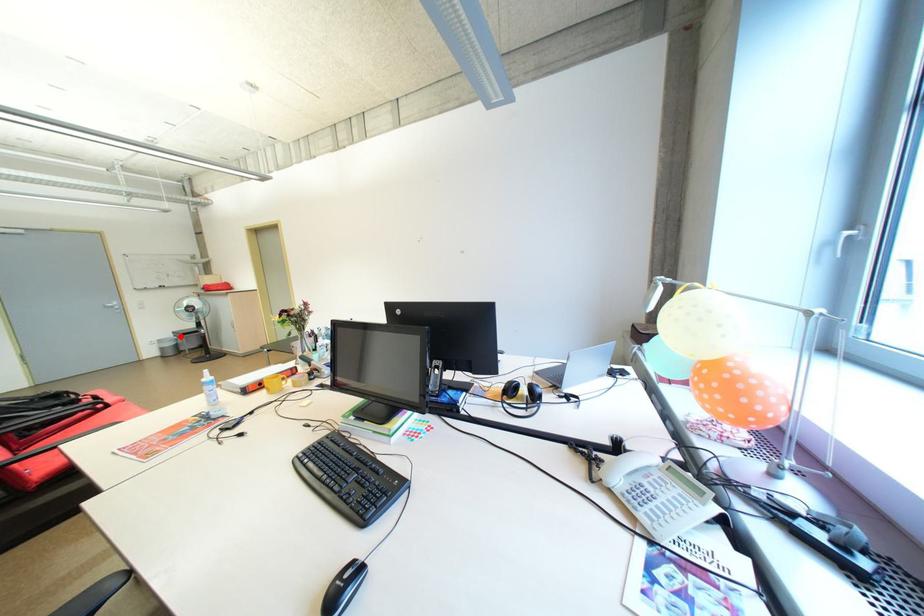
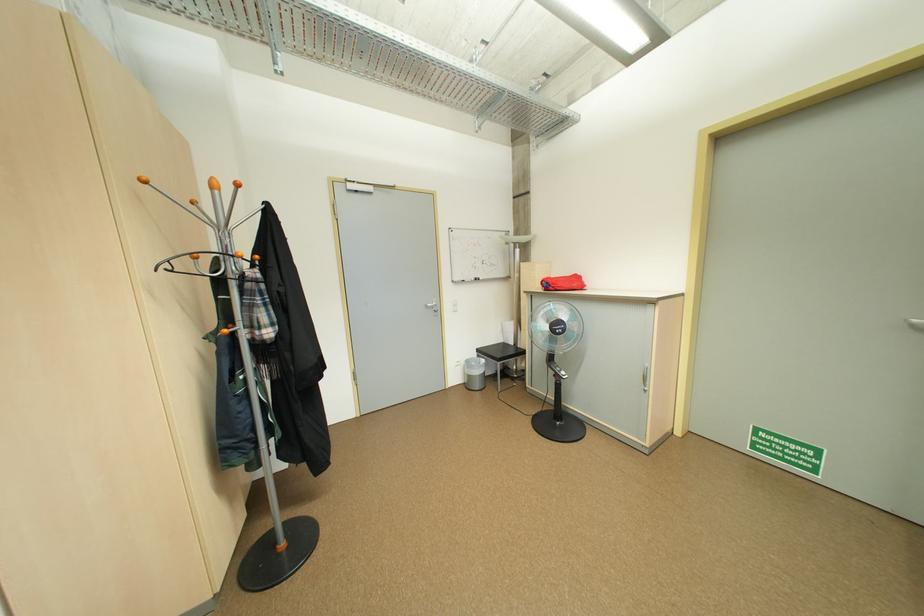
In the second image, find the point that corresponds to the highlighted location in the first image.

(483, 355)